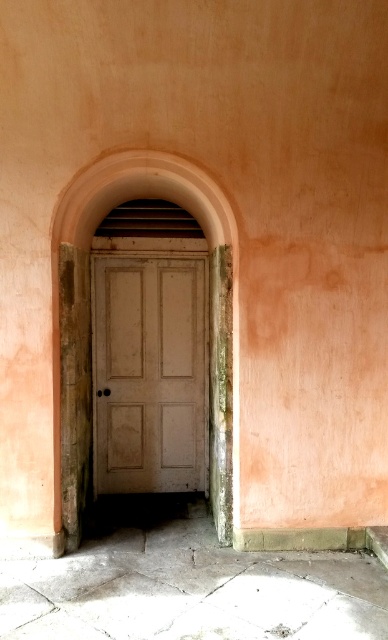
You are an interior designer planning to install a new door in a similar arched doorway. You have a door that is the same width as the white matte door at center. Can you confirm if the door will fit vertically within the smooth pink arch at center based on their heights?

The white matte door at center is not as tall as the smooth pink arch at center, so the door will fit vertically within the arch since it is shorter in height.

You are a painter who wants to hang a 60 cm wide painting between the white matte door at center and the smooth pink arch at center. Can you fit it there?

The white matte door at center and the smooth pink arch at center are 58.90 centimeters apart. Since the painting is 60 cm wide, it is slightly wider than the space available. Therefore, the painting cannot be hung there.